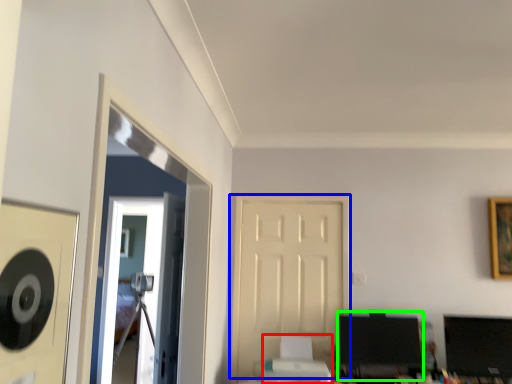
Question: Which object is positioned closest to printer (highlighted by a red box)? Select from door (highlighted by a blue box) and computer monitor (highlighted by a green box).

Choices:
 (A) door
 (B) computer monitor

Answer: (B)